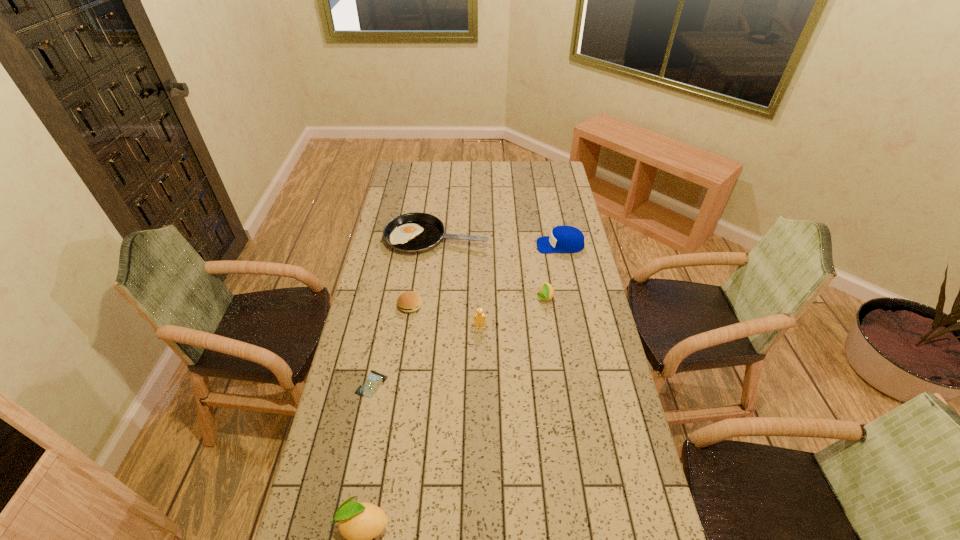
Locate an element on the screen. The width and height of the screenshot is (960, 540). vacant space at the near edge of the desktop is located at coordinates (442, 518).

This screenshot has width=960, height=540. In the image, there is a desktop. In order to click on vacant space at the left edge in this screenshot , I will do `click(359, 357)`.

Where is `vacant area at the right edge of the desktop`? The height and width of the screenshot is (540, 960). vacant area at the right edge of the desktop is located at coordinates (636, 460).

This screenshot has height=540, width=960. In the image, there is a desktop. In order to click on vacant space at the far left corner in this screenshot , I will do `click(405, 176)`.

Find the location of a particular element. This screenshot has height=540, width=960. free point between the shorter lemon and the Lego is located at coordinates (513, 313).

In order to click on free spot between the patty and the shorter lemon in this screenshot , I will do `click(477, 301)`.

At what (x,y) coordinates should I click in order to perform the action: click on empty location between the baseball cap and the frying pan. Please return your answer as a coordinate pair (x, y). Image resolution: width=960 pixels, height=540 pixels. Looking at the image, I should click on (498, 241).

What are the coordinates of `vacant area that lies between the patty and the Lego` in the screenshot? It's located at (444, 316).

The width and height of the screenshot is (960, 540). I want to click on empty space between the patty and the farther lemon, so click(477, 301).

Identify which object is located as the fourth nearest to the frying pan. Please provide its 2D coordinates. Your answer should be formatted as a tuple, i.e. [(x, y)], where the tuple contains the x and y coordinates of a point satisfying the conditions above.

[(479, 318)]